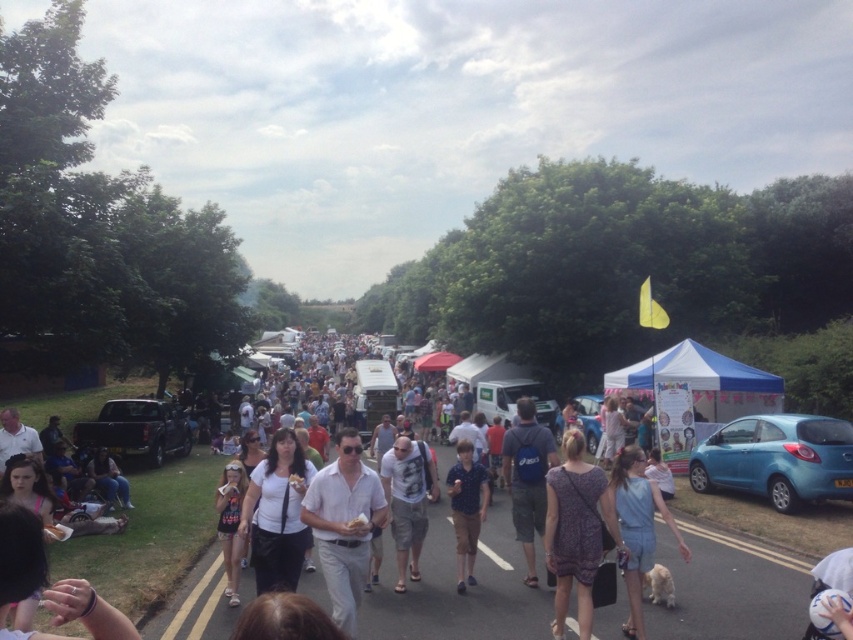
Question: Is matte white dress at center smaller than blue metallic car at center?

Choices:
 (A) yes
 (B) no

Answer: (A)

Question: Is white matte shirt at center bigger than blue metallic car at center?

Choices:
 (A) no
 (B) yes

Answer: (A)

Question: Considering the real-world distances, which object is closest to the blue cotton shirt at center?

Choices:
 (A) matte blue hatchback at right
 (B) dark blue backpack at center

Answer: (B)

Question: Which object is farther from the camera taking this photo?

Choices:
 (A) matte white dress at center
 (B) matte black truck at left
 (C) white cotton t-shirt at center

Answer: (B)

Question: Among these points, which one is farthest from the camera?

Choices:
 (A) pos(323,500)
 (B) pos(549,442)

Answer: (B)

Question: Does purple floral dress at center have a larger size compared to white matte shirt at center?

Choices:
 (A) no
 (B) yes

Answer: (B)